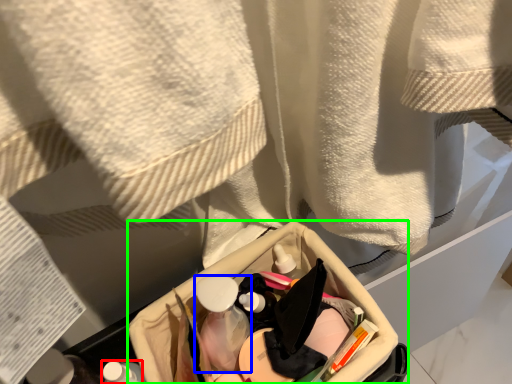
Question: Estimate the real-world distances between objects in this image. Which object is farther from toiletry (highlighted by a red box), mouthwash (highlighted by a blue box) or storage box (highlighted by a green box)?

Choices:
 (A) mouthwash
 (B) storage box

Answer: (B)